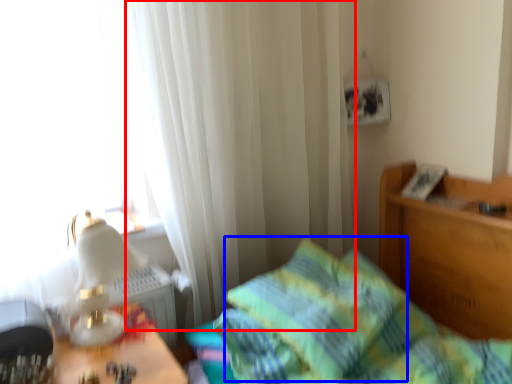
Question: Which point is further to the camera, curtain (highlighted by a red box) or pillow (highlighted by a blue box)?

Choices:
 (A) curtain
 (B) pillow

Answer: (A)